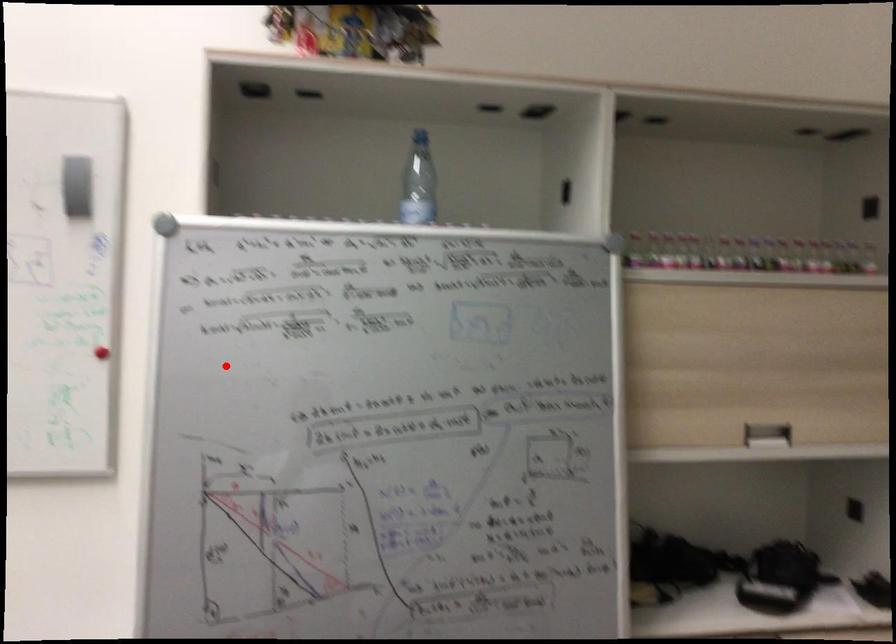
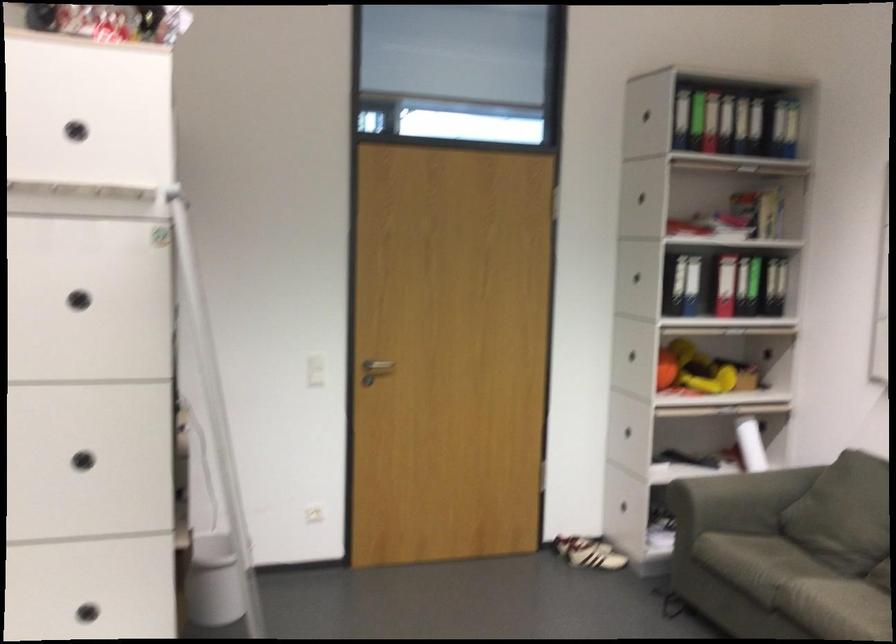
Question: I am providing you with two images of the same scene from different viewpoints. Image1 has a red point marked. In image2, the corresponding 3D location appears at what relative position? Reply with the corresponding letter.

Choices:
 (A) Closer
 (B) Farther

Answer: (B)